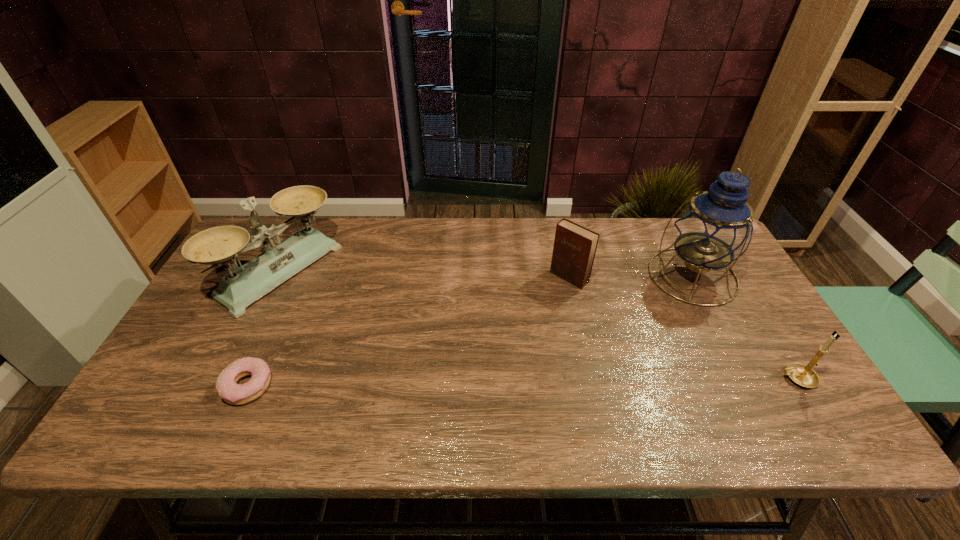
Locate an element on the screen. unoccupied area between the candle holder and the shortest object is located at coordinates (521, 382).

Identify which object is the closest to the lantern. Please provide its 2D coordinates. Your answer should be formatted as a tuple, i.e. [(x, y)], where the tuple contains the x and y coordinates of a point satisfying the conditions above.

[(574, 249)]

Where is `object that is the third closest to the candle holder`? object that is the third closest to the candle holder is located at coordinates (237, 290).

Find the location of a particular element. Image resolution: width=960 pixels, height=540 pixels. vacant area in the image that satisfies the following two spatial constraints: 1. on the back side of the candle holder; 2. on the handle side of the shortest object is located at coordinates (250, 378).

The height and width of the screenshot is (540, 960). In order to click on free space that satisfies the following two spatial constraints: 1. on the front side of the diary; 2. on the handle side of the candle holder in this screenshot , I will do `click(591, 378)`.

Locate an element on the screen. vacant area in the image that satisfies the following two spatial constraints: 1. on the front side of the candle holder; 2. on the handle side of the scale is located at coordinates (229, 378).